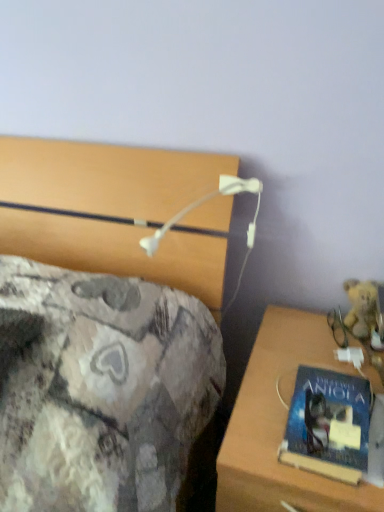
Question: Is blue matte book at right bigger than wooden desk at lower right?

Choices:
 (A) yes
 (B) no

Answer: (B)

Question: From the image's perspective, is blue matte book at right on wooden desk at lower right?

Choices:
 (A) yes
 (B) no

Answer: (A)

Question: Does blue matte book at right have a greater height compared to wooden desk at lower right?

Choices:
 (A) no
 (B) yes

Answer: (A)

Question: Does blue matte book at right lie behind wooden desk at lower right?

Choices:
 (A) no
 (B) yes

Answer: (B)

Question: Is blue matte book at right closer to the viewer compared to wooden desk at lower right?

Choices:
 (A) no
 (B) yes

Answer: (A)

Question: Is wooden desk at lower right bigger or smaller than fuzzy yellow teddy bear at right?

Choices:
 (A) big
 (B) small

Answer: (A)

Question: From the image's perspective, relative to fuzzy yellow teddy bear at right, is wooden desk at lower right above or below?

Choices:
 (A) below
 (B) above

Answer: (A)

Question: Considering the positions of point tap(372, 371) and point tap(352, 308), is point tap(372, 371) closer or farther from the camera than point tap(352, 308)?

Choices:
 (A) closer
 (B) farther

Answer: (A)

Question: Considering their positions, is wooden desk at lower right located in front of or behind fuzzy yellow teddy bear at right?

Choices:
 (A) behind
 (B) front

Answer: (B)

Question: Is fuzzy yellow teddy bear at right wider or thinner than blue matte book at right?

Choices:
 (A) wide
 (B) thin

Answer: (B)

Question: Relative to blue matte book at right, is fuzzy yellow teddy bear at right in front or behind?

Choices:
 (A) behind
 (B) front

Answer: (A)

Question: Considering the positions of fuzzy yellow teddy bear at right and blue matte book at right in the image, is fuzzy yellow teddy bear at right taller or shorter than blue matte book at right?

Choices:
 (A) tall
 (B) short

Answer: (A)

Question: Is fuzzy yellow teddy bear at right to the left or to the right of blue matte book at right in the image?

Choices:
 (A) right
 (B) left

Answer: (A)

Question: Considering the positions of fuzzy yellow teddy bear at right and wooden desk at lower right in the image, is fuzzy yellow teddy bear at right wider or thinner than wooden desk at lower right?

Choices:
 (A) thin
 (B) wide

Answer: (A)

Question: Considering the positions of point (347, 326) and point (254, 439), is point (347, 326) closer or farther from the camera than point (254, 439)?

Choices:
 (A) farther
 (B) closer

Answer: (A)